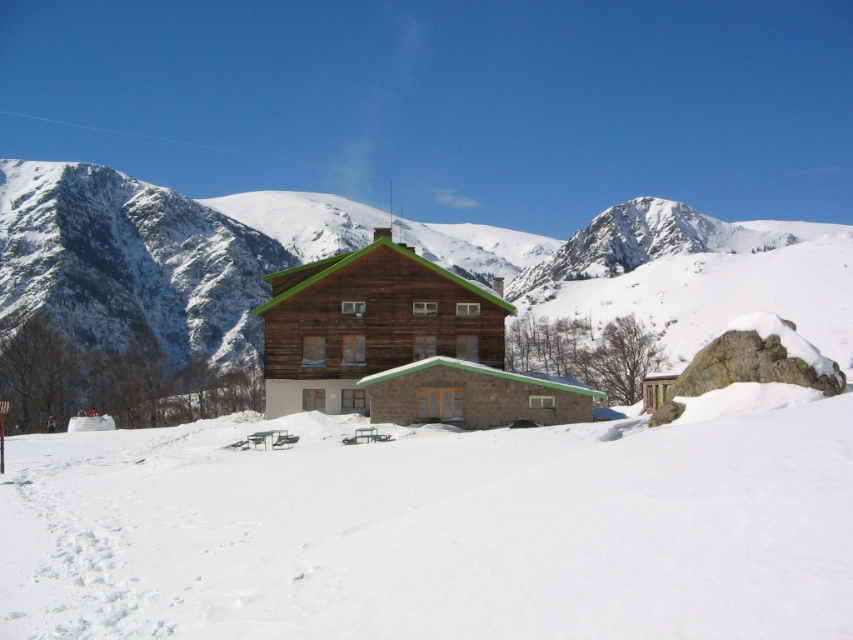
Does white snow at center appear under snowy rock at center?

Yes, white snow at center is below snowy rock at center.

Measure the distance between point (447, 576) and camera.

They are 36.87 meters apart.

In order to click on white snow at center in this screenshot , I will do `click(434, 532)`.

Is white snow at center positioned at the back of wooden cabin at center?

No, it is not.

Identify the location of white snow at center. The height and width of the screenshot is (640, 853). (434, 532).

Which is in front, point (675, 214) or point (392, 268)?

Point (392, 268) is in front.

Between snowy rock at center and wooden cabin at center, which one appears on the left side from the viewer's perspective?

wooden cabin at center

Which is behind, point (563, 292) or point (306, 401)?

Point (563, 292)

Where is `snowy rock at center`? The image size is (853, 640). snowy rock at center is located at coordinates (155, 253).